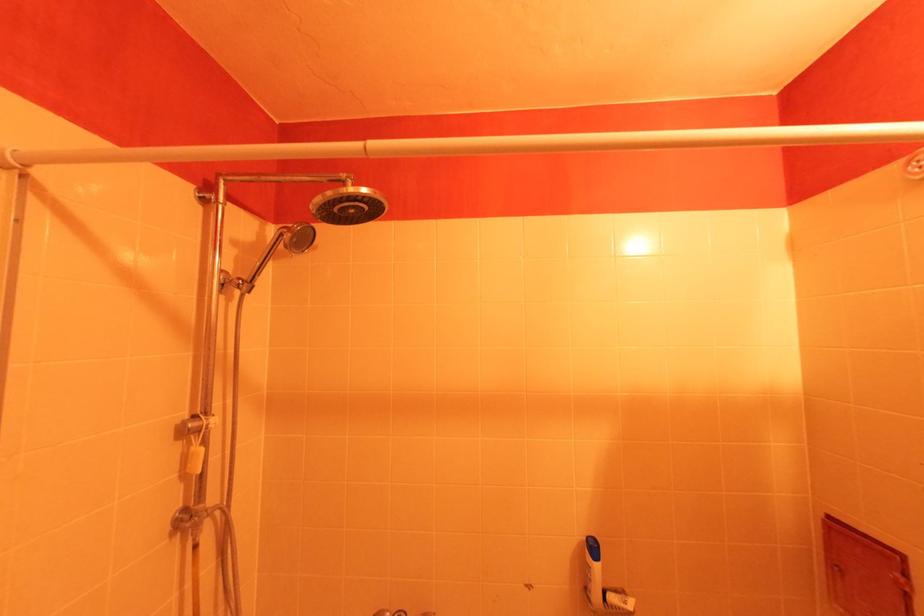
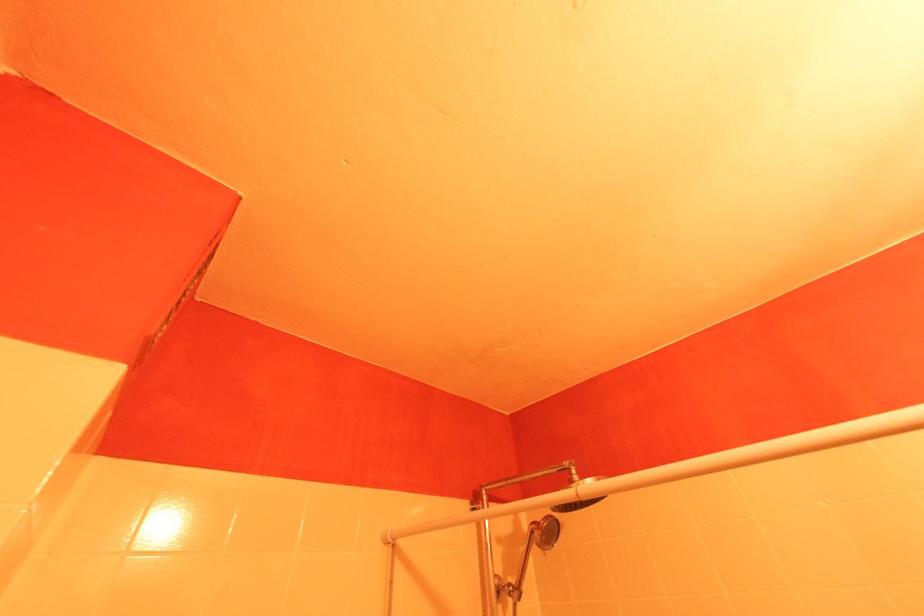
The first image is from the beginning of the video and the second image is from the end. How did the camera likely rotate when shooting the video?

The rotation direction of the camera is left-up.